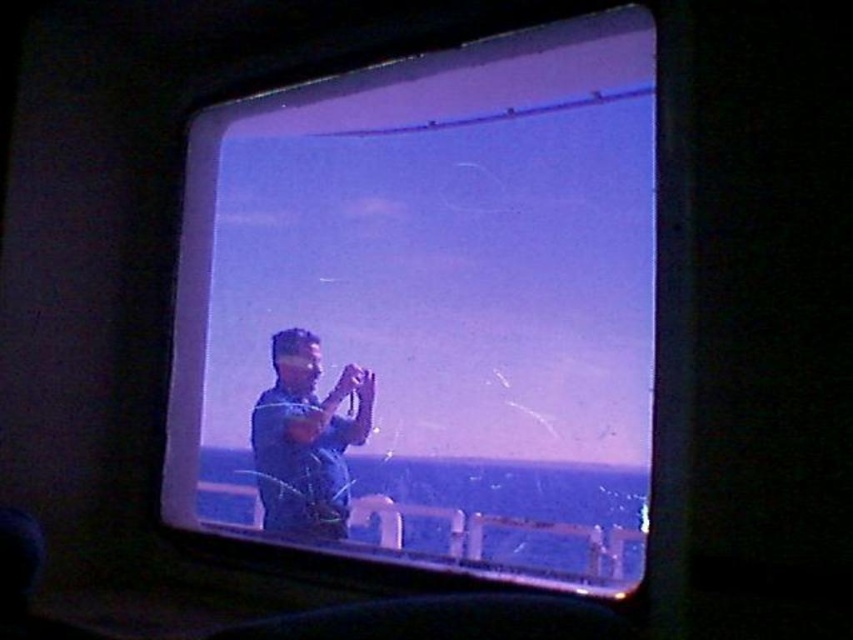
You are sitting inside an airplane and want to know where the transparent glass airplane window at center is located. Can you tell me its exact coordinates?

The transparent glass airplane window at center is located at coordinates point [428,308].

You are a passenger on an airplane and want to take a photo through the transparent glass airplane window at center. Your blue fabric shirt at center is currently blocking the view. Is there enough space to move your shirt out of the way so you can take the photo?

There is a distance of 18.36 inches between the transparent glass airplane window at center and blue fabric shirt at center, which should provide sufficient space to move the shirt out of the way and take the photo.

You are sitting inside a vehicle and looking through the purple tinted window. You notice two points marked on the window at coordinates point (630,134) and point (265,394). Which point is closer to you?

Point (630,134) is in front of point (265,394), so it is closer to you.